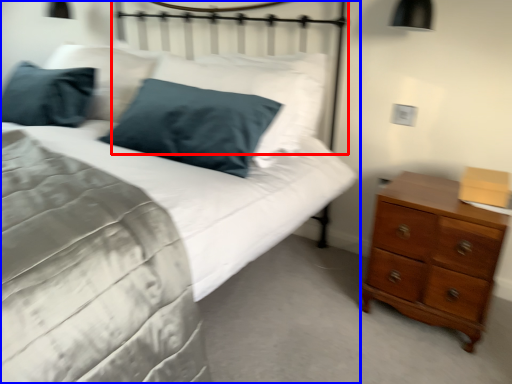
Question: Which of the following is the farthest to the observer, headboard (highlighted by a red box) or bed (highlighted by a blue box)?

Choices:
 (A) headboard
 (B) bed

Answer: (A)